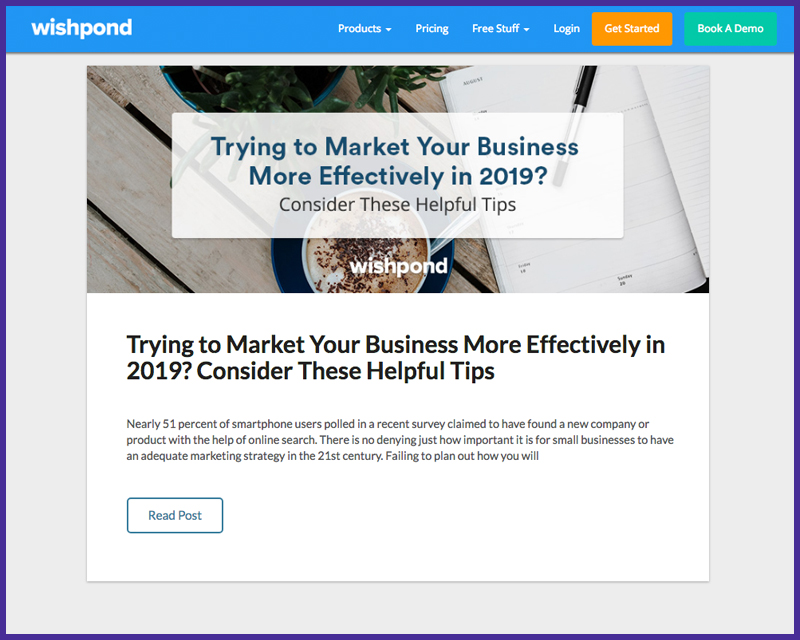
In order to click on pen in this screenshot , I will do click(x=582, y=86).